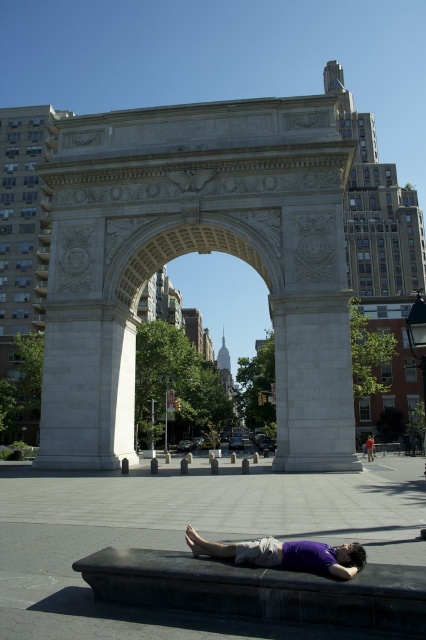
You are a photographer planning to take a picture of the purple matte shirt at lower center and the purple fabric at lower center. Since both are purple, you want to ensure they are distinguishable in the photo. Which object is located to the left of the other?

The purple matte shirt at lower center is positioned on the left side of purple fabric at lower center.

You are a photographer trying to capture the purple matte shirt at lower center and the purple fabric at lower center in the same frame. Which object should you focus on first if you want to ensure both are in focus without adjusting your camera settings?

The purple matte shirt at lower center is smaller in size compared to the purple fabric at lower center, so focusing on the purple matte shirt at lower center first would help ensure both are in focus since it requires a closer focus point.

You are a photographer planning to take a portrait of the person lying on the bench. You notice the purple matte shirt at lower center and the purple fabric at lower center. Which object should you focus on to capture the person in a relaxed pose?

The purple matte shirt at lower center is above the purple fabric at lower center, so focusing on the purple matte shirt at lower center would capture the person in a relaxed pose as it is closer to the camera.